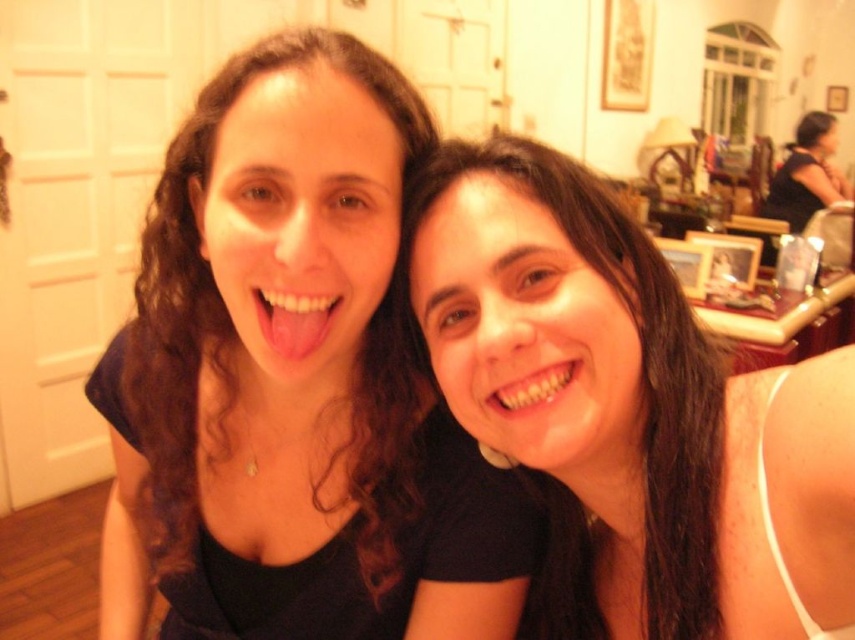
Which is in front, point (835, 138) or point (492, 406)?

Point (492, 406) is more forward.

How much distance is there between black fabric shirt at upper right and white glossy teeth at center?

5.32 meters

The height and width of the screenshot is (640, 855). What do you see at coordinates (806, 173) in the screenshot?
I see `black fabric shirt at upper right` at bounding box center [806, 173].

Identify the location of black fabric shirt at upper right. The height and width of the screenshot is (640, 855). (806, 173).

Is matte black shirt at center wider than white glossy teeth at center?

Yes.

Is matte black shirt at center above white glossy teeth at center?

Incorrect, matte black shirt at center is not positioned above white glossy teeth at center.

You are a GUI agent. You are given a task and a screenshot of the screen. Output one action in this format:
    pyautogui.click(x=<x>, y=<y>)
    Task: Click on the matte black shirt at center
    
    Given the screenshot: What is the action you would take?
    pyautogui.click(x=292, y=384)

At what (x,y) coordinates should I click in order to perform the action: click on matte black shirt at center. Please return your answer as a coordinate pair (x, y). The width and height of the screenshot is (855, 640). Looking at the image, I should click on (292, 384).

Can you confirm if matte black shirt at center is bigger than matte black hair at center?

Yes.

Can you confirm if matte black shirt at center is wider than matte black hair at center?

Yes, matte black shirt at center is wider than matte black hair at center.

The height and width of the screenshot is (640, 855). What do you see at coordinates (292, 384) in the screenshot?
I see `matte black shirt at center` at bounding box center [292, 384].

You are a GUI agent. You are given a task and a screenshot of the screen. Output one action in this format:
    pyautogui.click(x=<x>, y=<y>)
    Task: Click on the matte black shirt at center
    The image size is (855, 640).
    Given the screenshot: What is the action you would take?
    pyautogui.click(x=292, y=384)